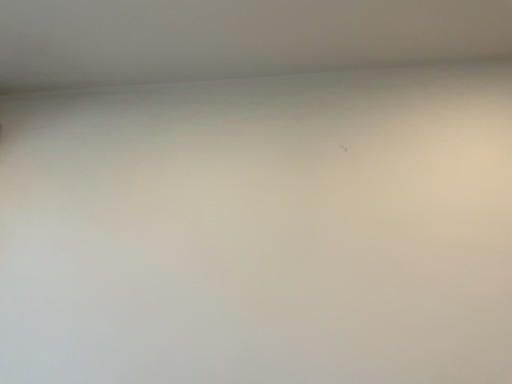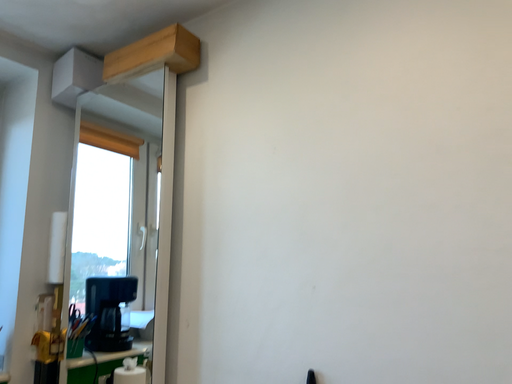
Question: How did the camera likely rotate when shooting the video?

Choices:
 (A) rotated left
 (B) rotated right

Answer: (A)